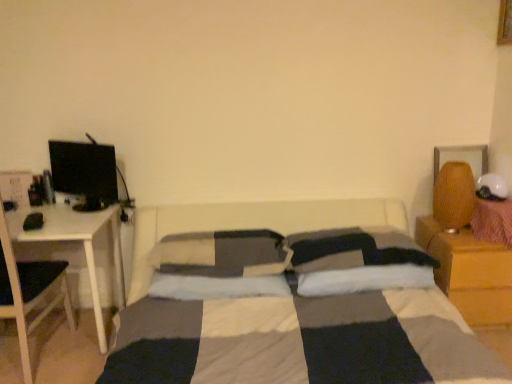
Where is `free space above white soft pillow at center, the 3th pillow when ordered from right to left (from a real-world perspective)`? free space above white soft pillow at center, the 3th pillow when ordered from right to left (from a real-world perspective) is located at coordinates (219, 235).